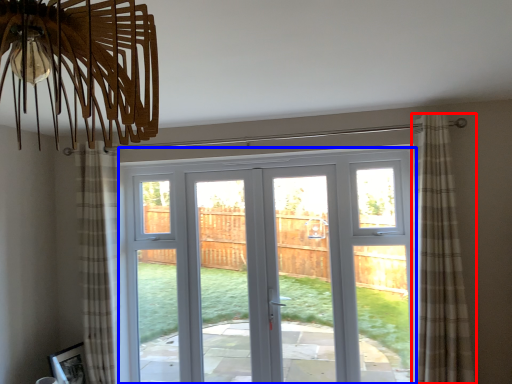
Question: Which point is further to the camera, curtain (highlighted by a red box) or door (highlighted by a blue box)?

Choices:
 (A) curtain
 (B) door

Answer: (B)